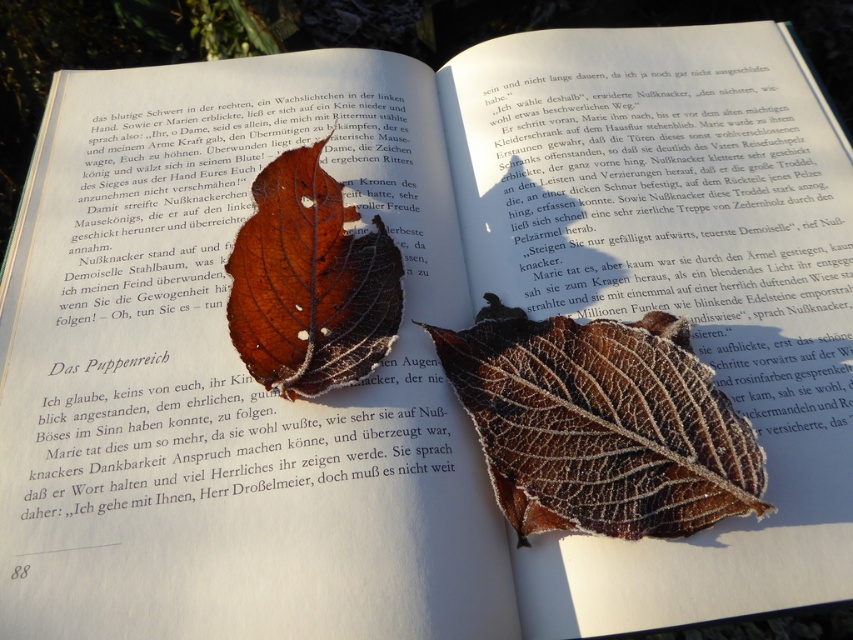
Can you confirm if frosted brown leaf at center is shorter than frosty brown leaf at center?

Yes, frosted brown leaf at center is shorter than frosty brown leaf at center.

Is frosted brown leaf at center smaller than frosty brown leaf at center?

Actually, frosted brown leaf at center might be larger than frosty brown leaf at center.

Between point (583, 392) and point (231, 310), which one is positioned behind?

The point (231, 310) is more distant.

This screenshot has width=853, height=640. What are the coordinates of `frosted brown leaf at center` in the screenshot? It's located at (601, 424).